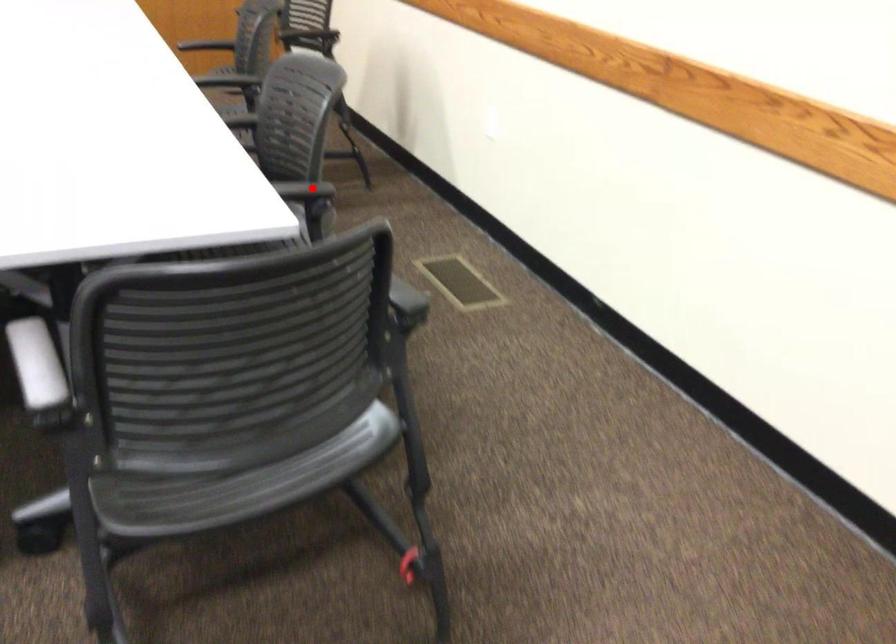
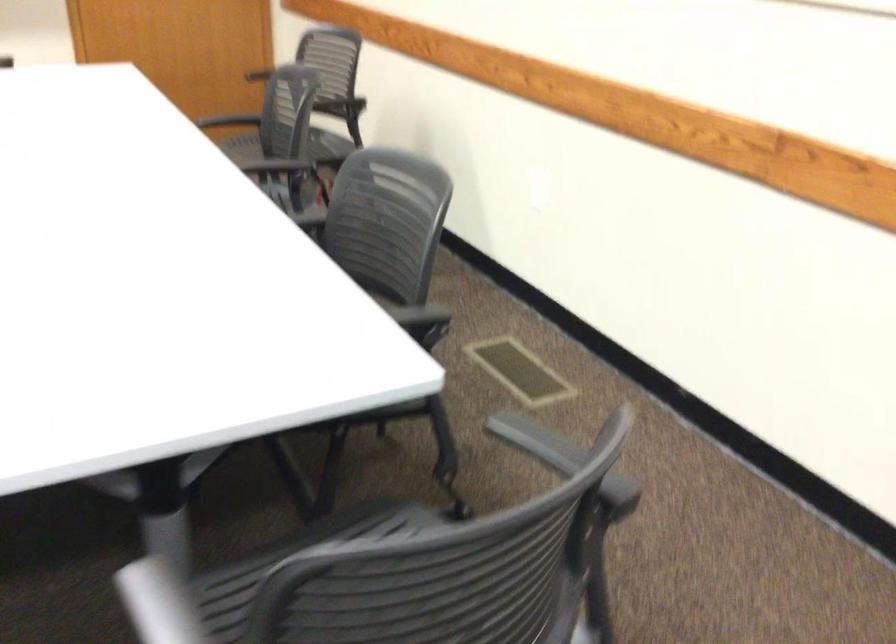
Question: I am providing you with two images of the same scene from different viewpoints. A red point is shown in image1. For the corresponding object point in image2, is it positioned nearer or farther from the camera?

Choices:
 (A) Nearer
 (B) Farther

Answer: (A)